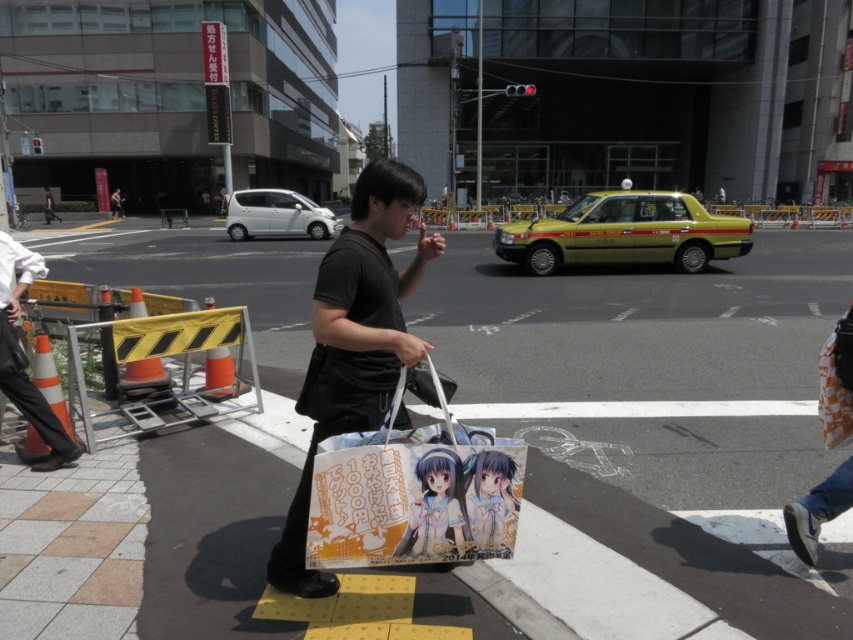
Can you confirm if smooth concrete pavement at center is taller than smooth matte anime girl at center?

Indeed, smooth concrete pavement at center has a greater height compared to smooth matte anime girl at center.

Is smooth concrete pavement at center to the left of smooth matte anime girl at center from the viewer's perspective?

In fact, smooth concrete pavement at center is to the right of smooth matte anime girl at center.

The height and width of the screenshot is (640, 853). What do you see at coordinates (664, 406) in the screenshot? I see `smooth concrete pavement at center` at bounding box center [664, 406].

Find the location of a particular element. This screenshot has width=853, height=640. smooth concrete pavement at center is located at coordinates (664, 406).

Does black leather pants at left have a larger size compared to glossy anime poster at center?

Correct, black leather pants at left is larger in size than glossy anime poster at center.

Which is in front, point (33, 410) or point (451, 468)?

Positioned in front is point (451, 468).

You are a GUI agent. You are given a task and a screenshot of the screen. Output one action in this format:
    pyautogui.click(x=<x>, y=<y>)
    Task: Click on the black leather pants at left
    
    Given the screenshot: What is the action you would take?
    pyautogui.click(x=24, y=356)

Between glossy anime poster at center and dark gray shirt at center, which one appears on the right side from the viewer's perspective?

glossy anime poster at center

Who is more distant from viewer, (432,484) or (45,209)?

The point (45,209) is more distant.

This screenshot has width=853, height=640. Identify the location of glossy anime poster at center. (436, 506).